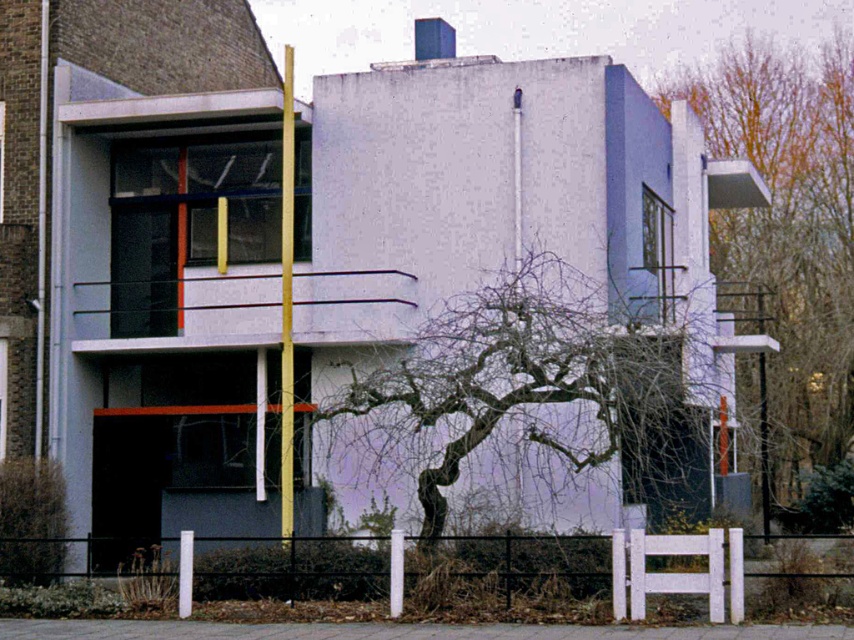
Question: Which point is farther from the camera taking this photo?

Choices:
 (A) (808, 177)
 (B) (408, 592)
 (C) (528, 365)

Answer: (A)

Question: Is bare branches at center to the right of white painted wood fence at lower center from the viewer's perspective?

Choices:
 (A) yes
 (B) no

Answer: (B)

Question: Which object is the closest to the bare branches at upper right?

Choices:
 (A) white painted wood fence at lower center
 (B) bare branches at center

Answer: (B)

Question: Considering the relative positions of bare branches at center and white painted wood fence at lower center in the image provided, where is bare branches at center located with respect to white painted wood fence at lower center?

Choices:
 (A) right
 (B) left

Answer: (B)

Question: Can you confirm if bare branches at center is positioned above white painted wood fence at lower center?

Choices:
 (A) yes
 (B) no

Answer: (A)

Question: Which point appears closest to the camera in this image?

Choices:
 (A) (607, 310)
 (B) (472, 611)

Answer: (B)